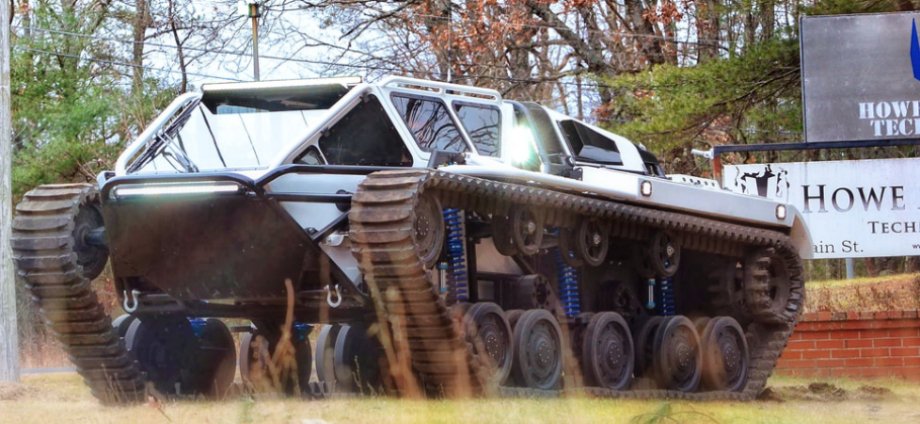
You are a GUI agent. You are given a task and a screenshot of the screen. Output one action in this format:
    pyautogui.click(x=<x>, y=<y>)
    Task: Click on the lights
    Image resolution: width=920 pixels, height=424 pixels.
    Given the screenshot: What is the action you would take?
    pyautogui.click(x=644, y=179), pyautogui.click(x=786, y=216)